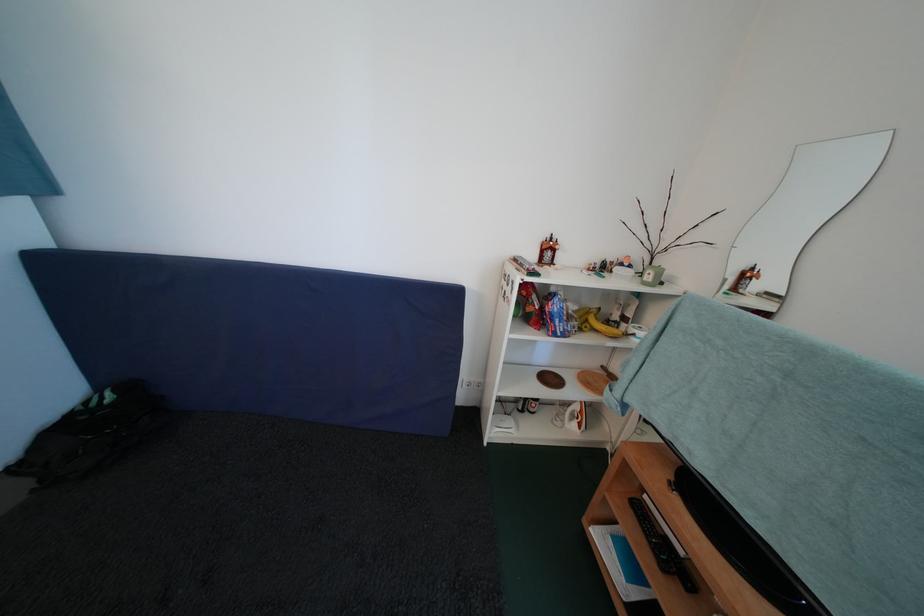
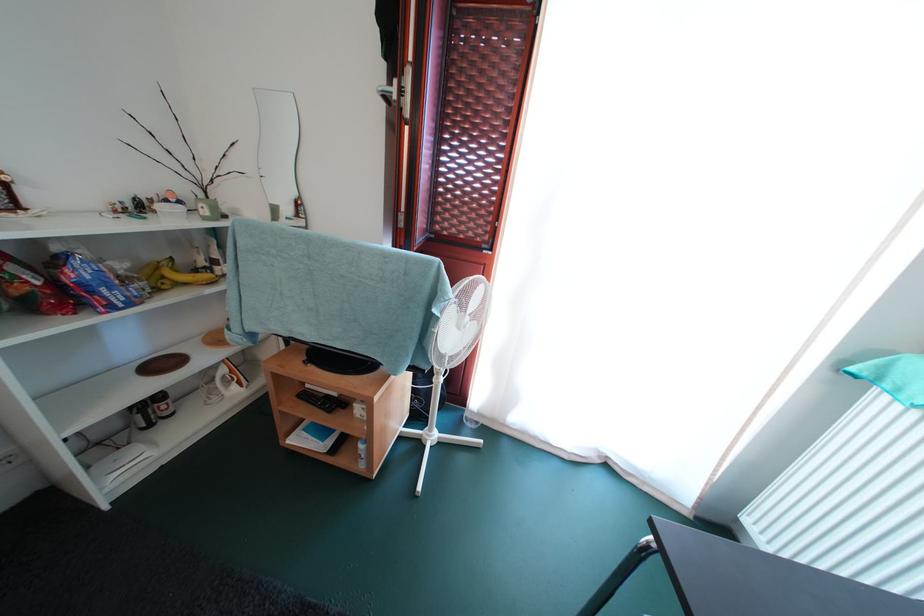
Where in the second image is the point corresponding to the point at 653,504 from the first image?

(314, 391)